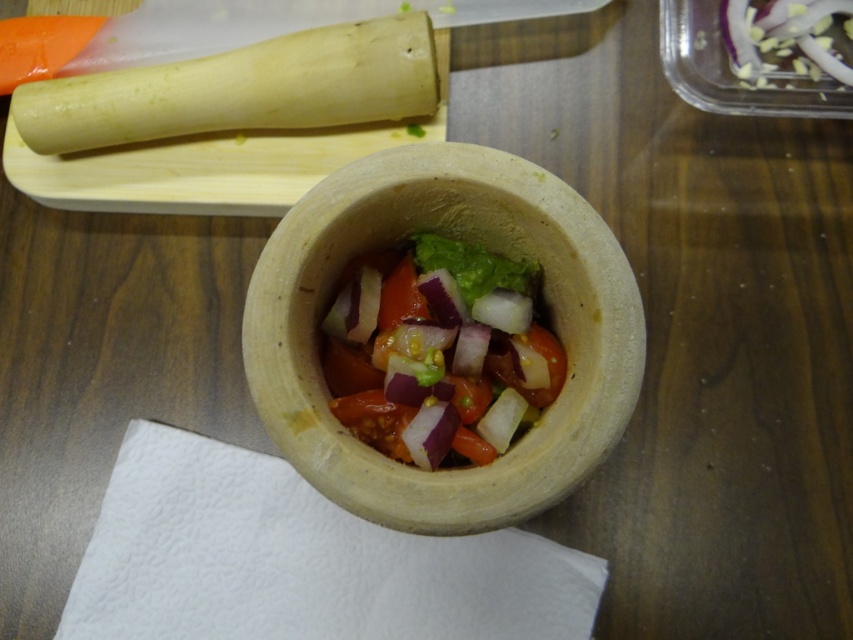
Question: Based on their relative distances, which object is nearer to the wooden cutting board at upper left?

Choices:
 (A) natural clay bowl at center
 (B) vibrant fresh salad at center

Answer: (B)

Question: Can you confirm if natural clay bowl at center is positioned above green leafy lettuce at center?

Choices:
 (A) no
 (B) yes

Answer: (A)

Question: Which point appears closest to the camera in this image?

Choices:
 (A) (509, 378)
 (B) (608, 337)
 (C) (466, 243)

Answer: (B)

Question: Does wooden cutting board at upper left appear on the right side of green leafy lettuce at center?

Choices:
 (A) yes
 (B) no

Answer: (B)

Question: Among these objects, which one is farthest from the camera?

Choices:
 (A) vibrant fresh salad at center
 (B) natural clay bowl at center

Answer: (A)

Question: Can you confirm if natural clay bowl at center is bigger than wooden cutting board at upper left?

Choices:
 (A) yes
 (B) no

Answer: (A)